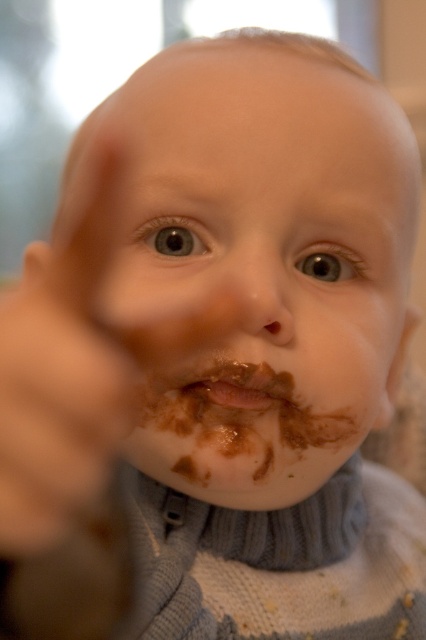
Based on the photo, you are a photographer adjusting lighting for a baby photo shoot. The baby has a chocolate matte face at center and a brown matte finger at center. To ensure both objects are evenly lit, which object requires more light adjustment since it is wider?

The chocolate matte face at center requires more light adjustment because its width is larger than the brown matte finger at center, so it needs more even lighting coverage.

You are a photographer trying to capture the baby in the image. The chocolate matte face at center and the brown matte finger at center are both in focus. Which object is closer to the camera?

The chocolate matte face at center is positioned over the brown matte finger at center, meaning the chocolate matte face at center is closer to the camera.